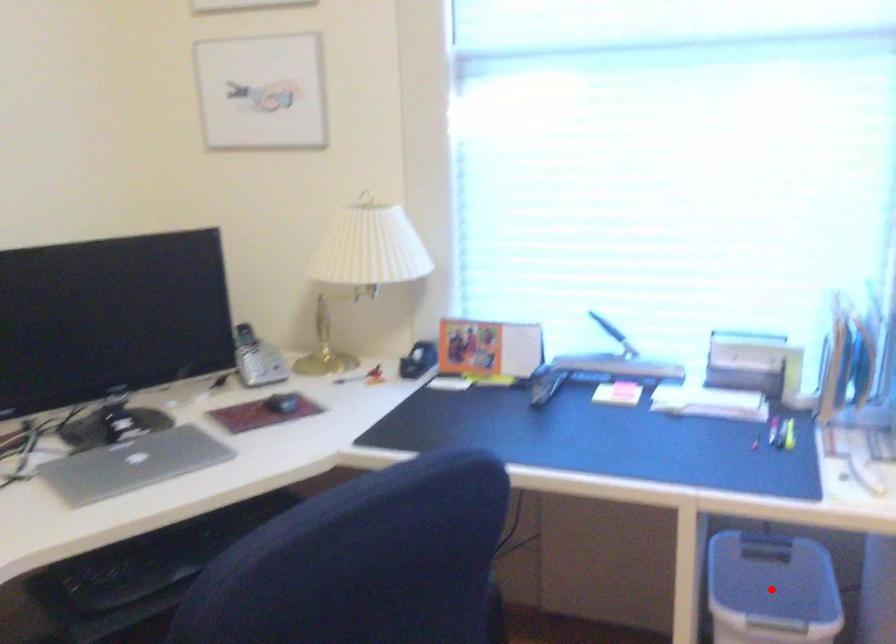
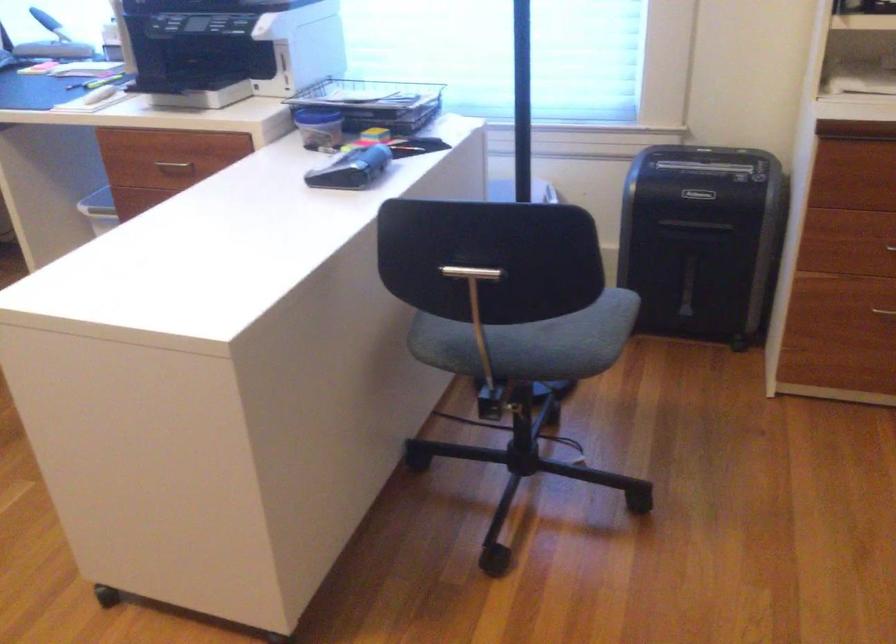
Question: I am providing you with two images of the same scene from different viewpoints. A red point is marked on the first image. Can you still see the location of the red point in image 2?

Choices:
 (A) Yes
 (B) No

Answer: (B)